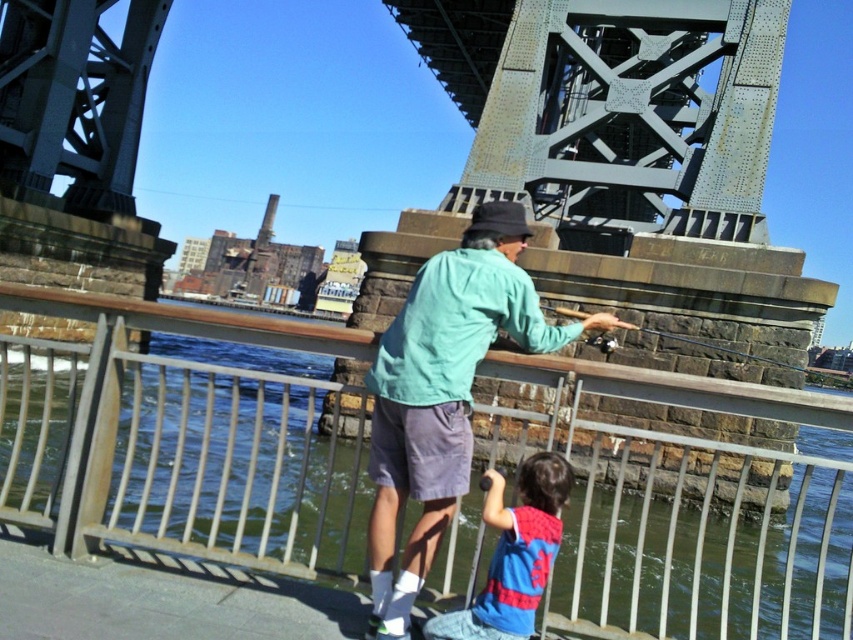
Question: Which object is the closest to the teal fabric jacket at center?

Choices:
 (A) metallic rod at center
 (B) metal/rustic rail at center

Answer: (A)

Question: Does metal/rustic rail at center appear over teal fabric jacket at center?

Choices:
 (A) no
 (B) yes

Answer: (A)

Question: Can you confirm if teal fabric jacket at center is positioned to the right of blue cotton shirt at lower center?

Choices:
 (A) no
 (B) yes

Answer: (A)

Question: Which of the following is the closest to the observer?

Choices:
 (A) (683, 600)
 (B) (494, 525)

Answer: (B)

Question: Among these objects, which one is farthest from the camera?

Choices:
 (A) blue cotton shirt at lower center
 (B) teal fabric jacket at center
 (C) metal/rustic rail at center

Answer: (A)

Question: Is metal/rustic rail at center closer to the viewer compared to blue cotton shirt at lower center?

Choices:
 (A) yes
 (B) no

Answer: (A)